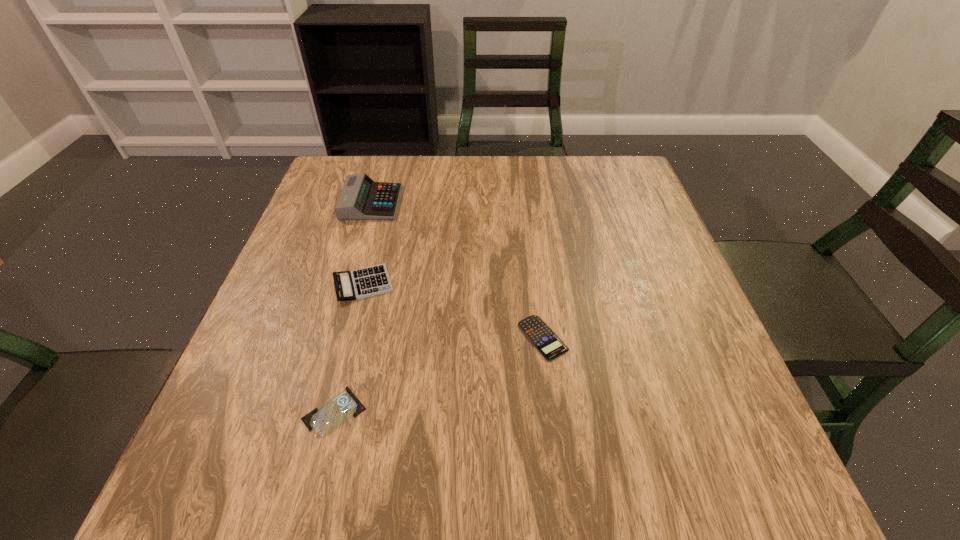
Where is `free space located on the back of the second shortest object`? The width and height of the screenshot is (960, 540). free space located on the back of the second shortest object is located at coordinates click(x=536, y=284).

This screenshot has width=960, height=540. I want to click on vacant space located on the right of the shortest object, so click(x=439, y=411).

The image size is (960, 540). What are the coordinates of `object that is at the far edge` in the screenshot? It's located at (361, 198).

Locate an element on the screen. This screenshot has height=540, width=960. identity card that is positioned at the left edge is located at coordinates (323, 421).

Identify the location of object positioned at the far left corner. The height and width of the screenshot is (540, 960). (361, 198).

Find the location of a particular element. free space at the far edge is located at coordinates (460, 169).

You are a GUI agent. You are given a task and a screenshot of the screen. Output one action in this format:
    pyautogui.click(x=<x>, y=<y>)
    Task: Click on the vacant region at the near edge of the desktop
    Image resolution: width=960 pixels, height=540 pixels.
    Given the screenshot: What is the action you would take?
    pyautogui.click(x=467, y=504)

In the image, there is a desktop. Where is `free space at the left edge`? The width and height of the screenshot is (960, 540). free space at the left edge is located at coordinates (233, 383).

The width and height of the screenshot is (960, 540). Find the location of `free space at the right edge`. free space at the right edge is located at coordinates (689, 443).

In order to click on vacant region at the far left corner of the desktop in this screenshot , I will do pyautogui.click(x=386, y=159).